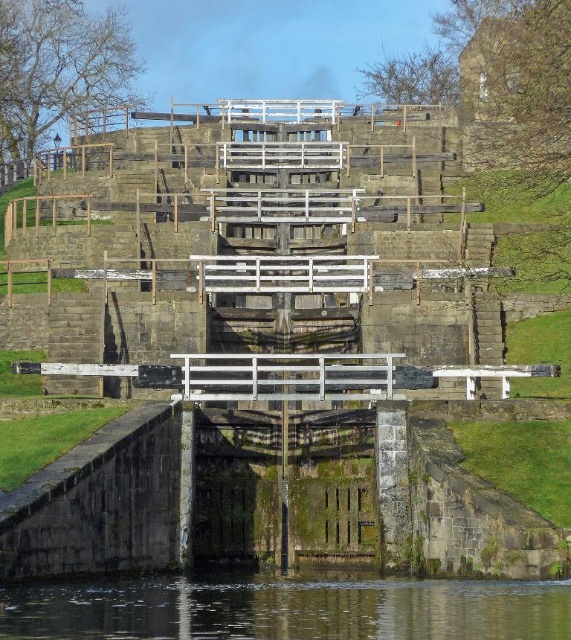
Question: In this image, where is weathered stone stairs at center located relative to clear water at bottom?

Choices:
 (A) right
 (B) left

Answer: (B)

Question: Which point is closer to the camera taking this photo?

Choices:
 (A) (287, 282)
 (B) (379, 598)

Answer: (B)

Question: Which point is closer to the camera?

Choices:
 (A) clear water at bottom
 (B) weathered stone stairs at center

Answer: (A)

Question: Where is weathered stone stairs at center located in relation to clear water at bottom in the image?

Choices:
 (A) above
 (B) below

Answer: (A)

Question: Which point is farther from the camera taking this photo?

Choices:
 (A) (266, 636)
 (B) (307, 212)

Answer: (B)

Question: Does weathered stone stairs at center appear on the right side of clear water at bottom?

Choices:
 (A) no
 (B) yes

Answer: (A)